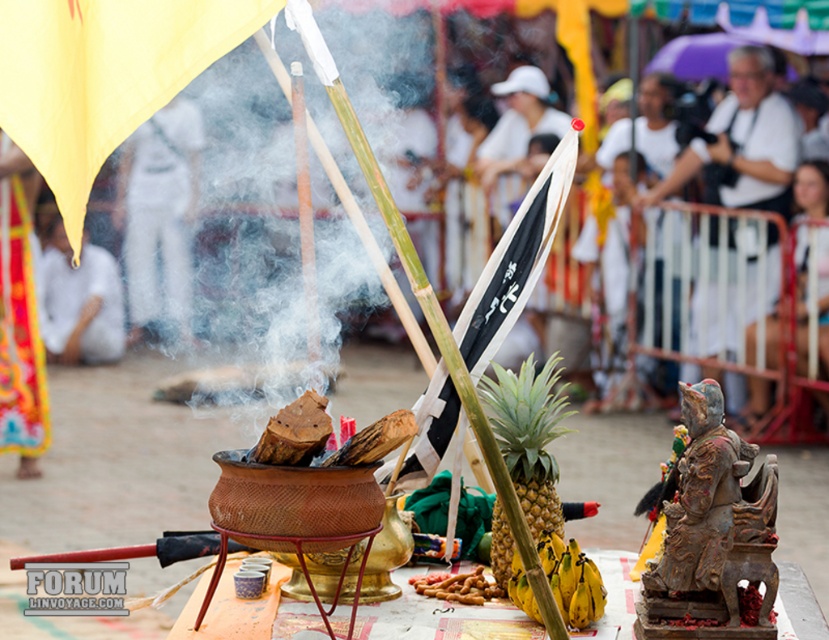
Who is higher up, white cotton shirt at lower left or yellow matte bananas at center?

white cotton shirt at lower left

Locate an element on the screen. The width and height of the screenshot is (829, 640). white cotton shirt at lower left is located at coordinates [x=80, y=301].

Image resolution: width=829 pixels, height=640 pixels. In order to click on white cotton shirt at lower left in this screenshot , I will do `click(80, 301)`.

Is point (158, 118) positioned after point (546, 476)?

That is True.

Between white cotton shirt at upper center and yellow/green pineapple at center, which one is positioned lower?

yellow/green pineapple at center

Is point (161, 276) behind point (531, 369)?

Yes.

The image size is (829, 640). I want to click on white cotton shirt at upper center, so click(158, 216).

Between bronze statue at right and yellow matte bananas at center, which one is positioned lower?

Positioned lower is yellow matte bananas at center.

Can you confirm if bronze statue at right is taller than yellow matte bananas at center?

Indeed, bronze statue at right has a greater height compared to yellow matte bananas at center.

I want to click on bronze statue at right, so click(711, 532).